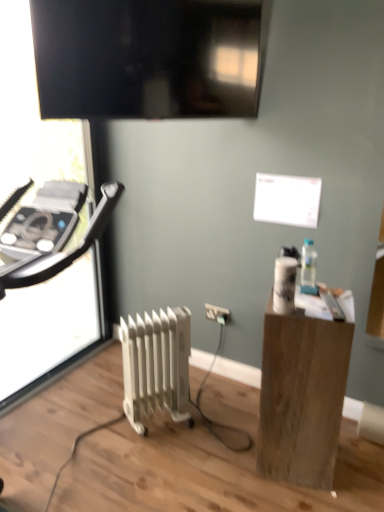
Question: Is matte black tv at upper center shorter than wooden block at right?

Choices:
 (A) no
 (B) yes

Answer: (B)

Question: Considering the relative sizes of matte black tv at upper center and wooden block at right in the image provided, is matte black tv at upper center taller than wooden block at right?

Choices:
 (A) no
 (B) yes

Answer: (A)

Question: From the image's perspective, is matte black tv at upper center below wooden block at right?

Choices:
 (A) yes
 (B) no

Answer: (B)

Question: Is wooden block at right a part of matte black tv at upper center?

Choices:
 (A) yes
 (B) no

Answer: (B)

Question: Does matte black tv at upper center appear on the left side of wooden block at right?

Choices:
 (A) no
 (B) yes

Answer: (B)

Question: In terms of height, does matte black tv at upper center look taller or shorter compared to wooden block at right?

Choices:
 (A) tall
 (B) short

Answer: (B)

Question: From a real-world perspective, is matte black tv at upper center physically located above or below wooden block at right?

Choices:
 (A) above
 (B) below

Answer: (A)

Question: Do you think matte black tv at upper center is within wooden block at right, or outside of it?

Choices:
 (A) outside
 (B) inside

Answer: (A)

Question: Considering their positions, is matte black tv at upper center located in front of or behind wooden block at right?

Choices:
 (A) front
 (B) behind

Answer: (B)

Question: Considering the positions of white plastic electric outlet at center and clear glass bottle at right in the image, is white plastic electric outlet at center wider or thinner than clear glass bottle at right?

Choices:
 (A) thin
 (B) wide

Answer: (A)

Question: Is point (208, 309) closer or farther from the camera than point (306, 272)?

Choices:
 (A) farther
 (B) closer

Answer: (A)

Question: From the image's perspective, is white plastic electric outlet at center located above or below clear glass bottle at right?

Choices:
 (A) below
 (B) above

Answer: (A)

Question: Is white plastic electric outlet at center in front of or behind clear glass bottle at right in the image?

Choices:
 (A) behind
 (B) front

Answer: (A)

Question: Relative to transparent glass screen door at left, is white plastic electric outlet at center in front or behind?

Choices:
 (A) behind
 (B) front

Answer: (A)

Question: Based on their sizes in the image, would you say white plastic electric outlet at center is bigger or smaller than transparent glass screen door at left?

Choices:
 (A) big
 (B) small

Answer: (B)